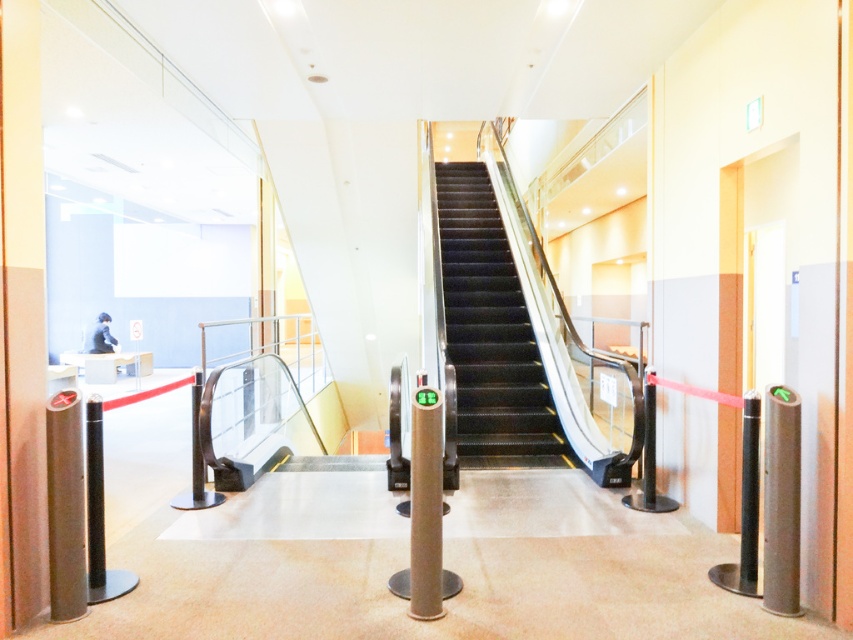
Identify the location of black glossy escalator at center. This screenshot has height=640, width=853. (491, 333).

Between black glossy escalator at center and metallic silver post at right, which one is positioned higher?

black glossy escalator at center

Is point (490, 234) positioned before point (764, 394)?

No, it is behind (764, 394).

The height and width of the screenshot is (640, 853). What are the coordinates of `black glossy escalator at center` in the screenshot? It's located at (491, 333).

Can you confirm if metallic gray post at left is thinner than metallic silver post at right?

Incorrect, metallic gray post at left's width is not less than metallic silver post at right's.

Who is positioned more to the right, metallic gray post at left or metallic silver post at right?

Positioned to the right is metallic silver post at right.

The width and height of the screenshot is (853, 640). What are the coordinates of `metallic gray post at left` in the screenshot? It's located at (65, 506).

Can you confirm if metallic gray post at left is positioned below metallic gray post at center?

Actually, metallic gray post at left is above metallic gray post at center.

Who is positioned more to the left, metallic gray post at left or metallic gray post at center?

metallic gray post at left is more to the left.

Between point (68, 522) and point (425, 525), which one is positioned behind?

Positioned behind is point (425, 525).

Locate an element on the screen. metallic gray post at left is located at coordinates (65, 506).